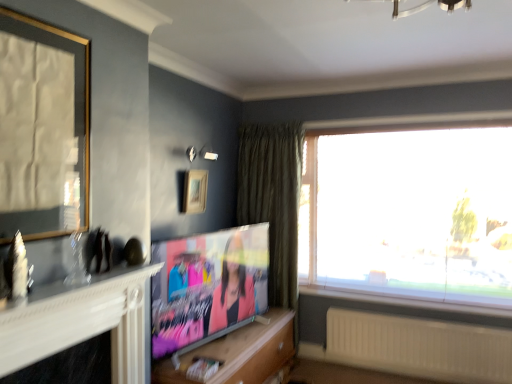
This screenshot has width=512, height=384. I want to click on blank area beneath matte paper magazine at lower center (from a real-world perspective), so click(x=201, y=373).